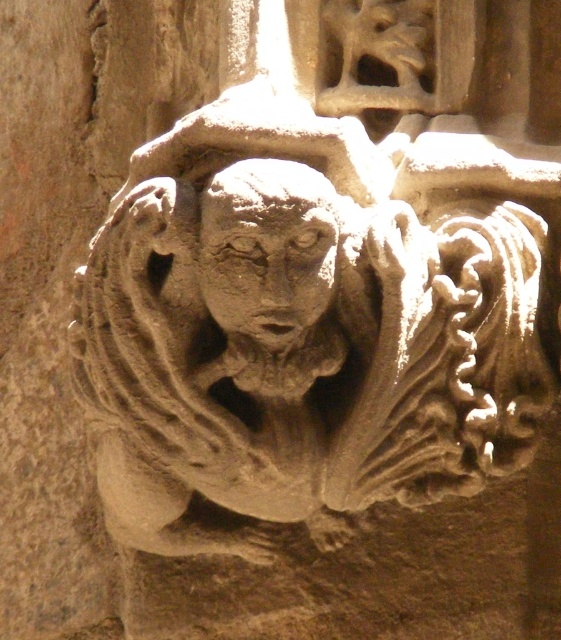
You are an art restorer examining the stone details on a cathedral. You notice two elements at the center of your view, the gray stone lion at center and the gray stone face at center. Which one do you think is bigger?

The gray stone lion at center is larger in size compared to the gray stone face at center according to the description.

You are an art conservator examining a historical stone carving. You notice two elements at the center of the carving, the gray stone lion at center and the gray stone face at center. Which of these two elements is taller?

The gray stone lion at center is taller than the gray stone face at center.